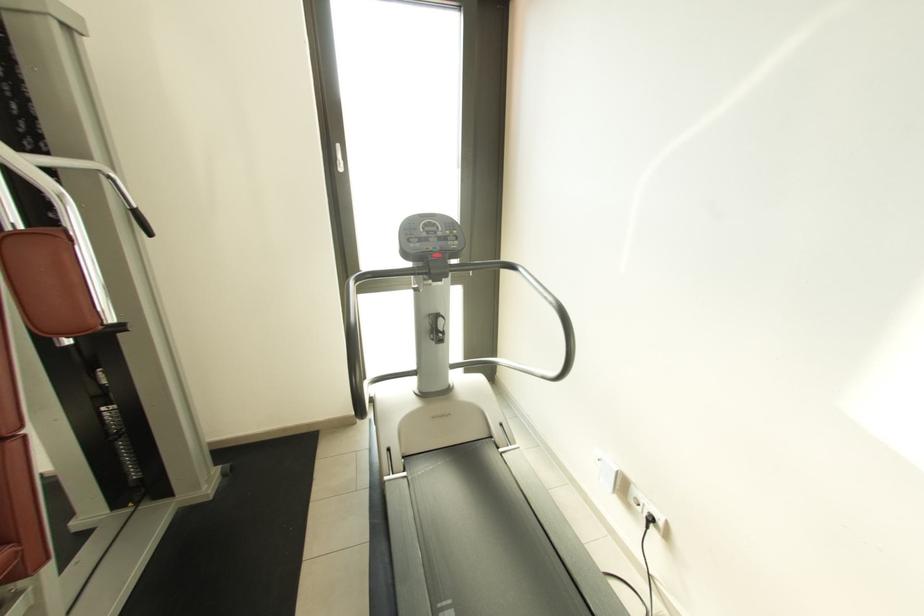
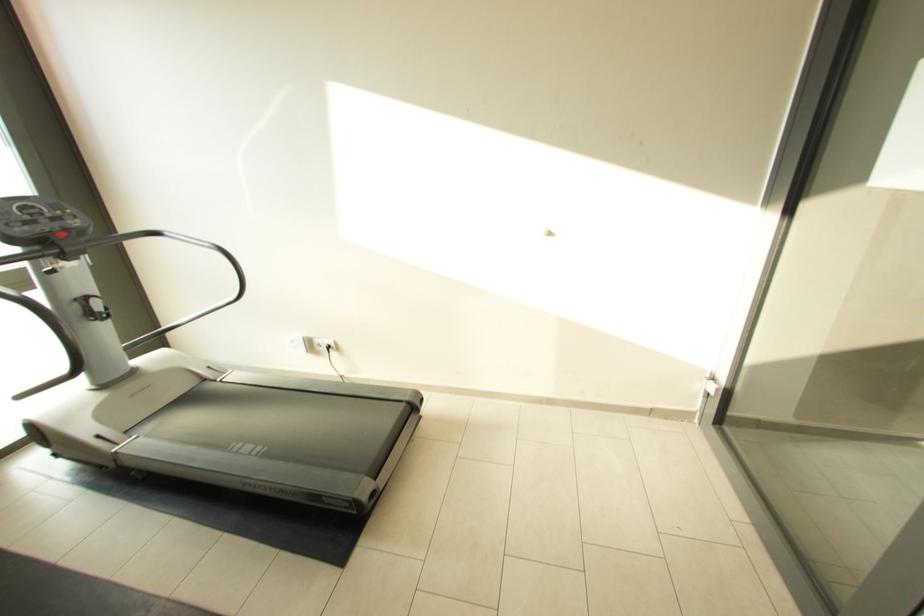
Locate, in the second image, the point that corresponds to pixel 640 493 in the first image.

(322, 342)